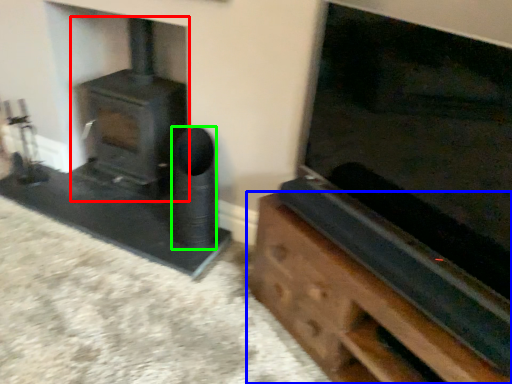
Question: Which object is positioned farthest from wood burning stove (highlighted by a red box)? Select from furniture (highlighted by a blue box) and speaker (highlighted by a green box).

Choices:
 (A) furniture
 (B) speaker

Answer: (A)